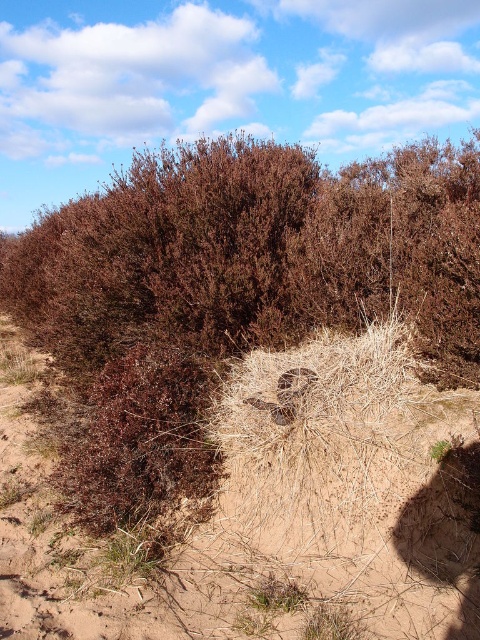
Who is taller, brown dry bush at center or dry straw nest at center?

Standing taller between the two is brown dry bush at center.

Is point (414, 321) positioned behind point (427, 445)?

Yes, it is.

Find the location of a particular element. Image resolution: width=480 pixels, height=640 pixels. brown dry bush at center is located at coordinates (254, 256).